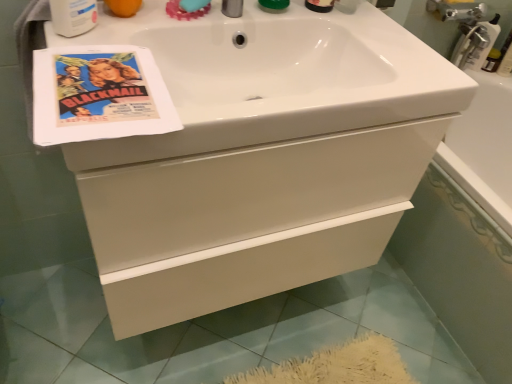
Find the location of a particular element. The height and width of the screenshot is (384, 512). vacant area located to the right-hand side of teal rubber soap at upper center is located at coordinates (251, 13).